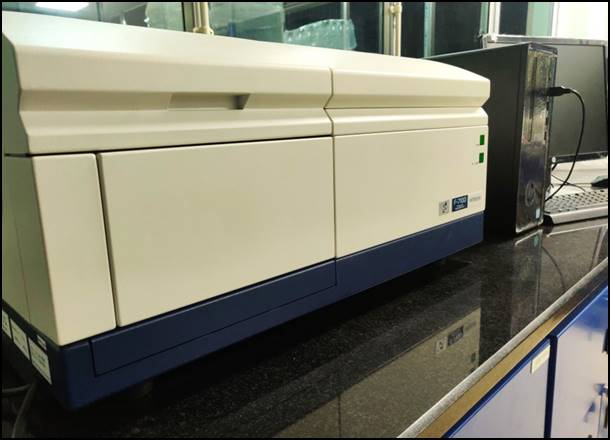
You are a GUI agent. You are given a task and a screenshot of the screen. Output one action in this format:
    pyautogui.click(x=<x>, y=<y>)
    Task: Click on the monitor
    This screenshot has width=610, height=440.
    Given the screenshot: What is the action you would take?
    pyautogui.click(x=592, y=53)